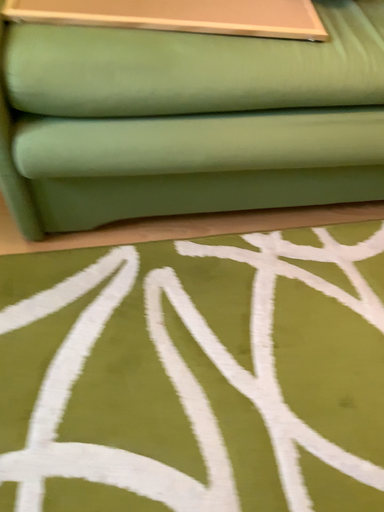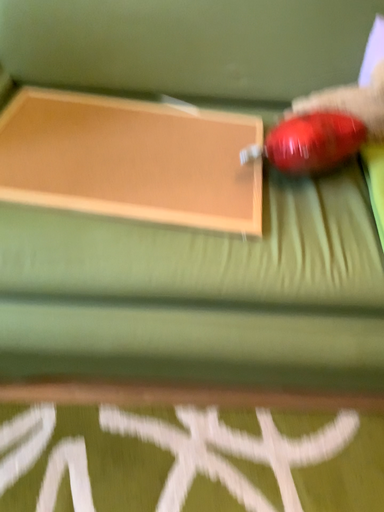
Question: Which way did the camera rotate in the video?

Choices:
 (A) rotated left
 (B) rotated right

Answer: (A)